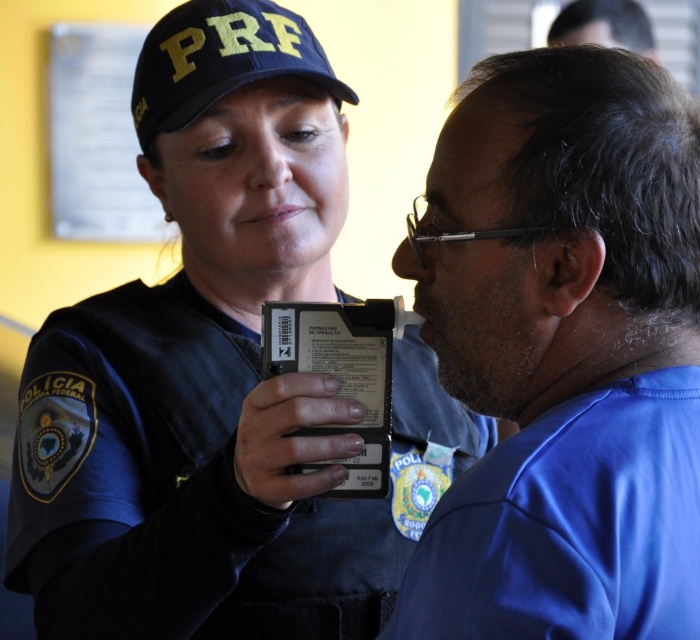
Locate an element on the screen. The width and height of the screenshot is (700, 640). blue fabric shirt at right is located at coordinates (564, 353).

Is blue fabric shirt at right shorter than dark brown hair at upper right?

No, blue fabric shirt at right is not shorter than dark brown hair at upper right.

Between point (494, 580) and point (640, 12), which one is positioned behind?

Point (640, 12)

Find the location of a particular element. The image size is (700, 640). blue fabric shirt at right is located at coordinates (564, 353).

Is blue fabric shirt at center bigger than black plastic card at center?

Indeed, blue fabric shirt at center has a larger size compared to black plastic card at center.

The width and height of the screenshot is (700, 640). What do you see at coordinates (570, 525) in the screenshot?
I see `blue fabric shirt at center` at bounding box center [570, 525].

At what (x,y) coordinates should I click in order to perform the action: click on blue fabric shirt at center. Please return your answer as a coordinate pair (x, y). This screenshot has height=640, width=700. Looking at the image, I should click on (570, 525).

Which is more to the right, blue fabric shirt at right or blue fabric shirt at center?

blue fabric shirt at center is more to the right.

Between blue fabric shirt at right and blue fabric shirt at center, which one is positioned lower?

blue fabric shirt at center is below.

Describe the element at coordinates (564, 353) in the screenshot. I see `blue fabric shirt at right` at that location.

At what (x,y) coordinates should I click in order to perform the action: click on blue fabric shirt at right. Please return your answer as a coordinate pair (x, y). Looking at the image, I should click on (564, 353).